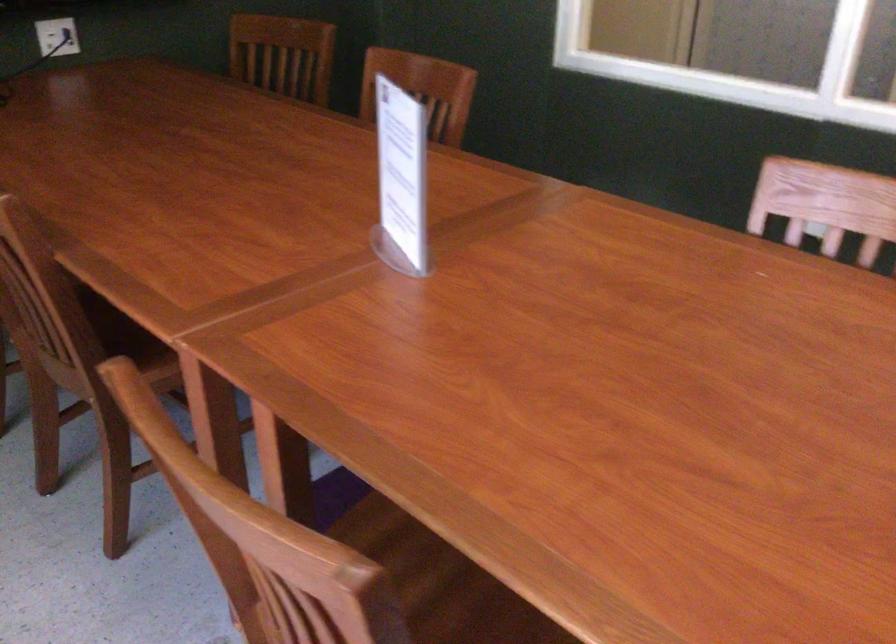
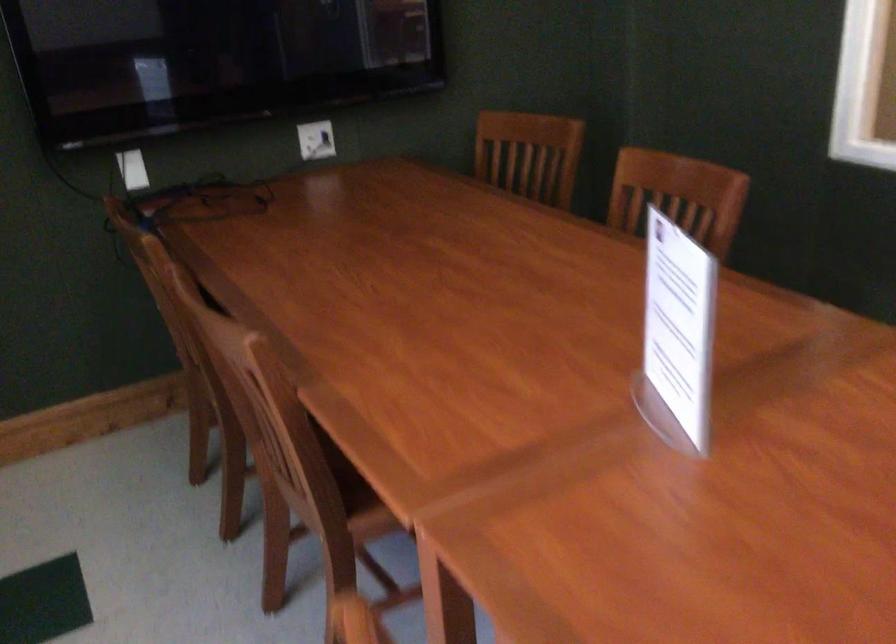
Where in the second image is the point corresponding to [420,91] from the first image?

(677, 196)